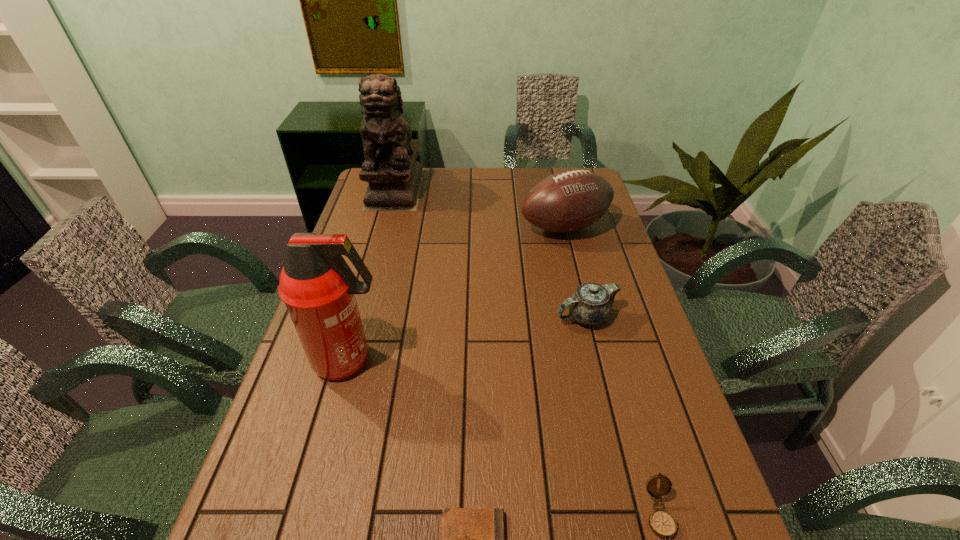
I want to click on sculpture, so click(394, 176).

What are the coordinates of `fire extinguisher` in the screenshot? It's located at (316, 284).

The height and width of the screenshot is (540, 960). I want to click on football (American), so click(x=570, y=200).

The width and height of the screenshot is (960, 540). I want to click on the fourth nearest object, so [x=591, y=304].

Identify the location of the third shortest object. (591, 304).

Locate an element on the screen. vacant position located 0.260m on the front-facing side of the sculpture is located at coordinates (377, 256).

This screenshot has width=960, height=540. I want to click on vacant position located on the trigger side of the third nearest object, so click(408, 360).

The width and height of the screenshot is (960, 540). In order to click on free spot located on the back of the football (American) in this screenshot , I will do `click(550, 168)`.

The image size is (960, 540). What are the coordinates of `vacant space located from the spout of the chinaware` in the screenshot? It's located at (504, 317).

Image resolution: width=960 pixels, height=540 pixels. In order to click on free spot located 0.380m from the spout of the chinaware in this screenshot , I will do `click(418, 317)`.